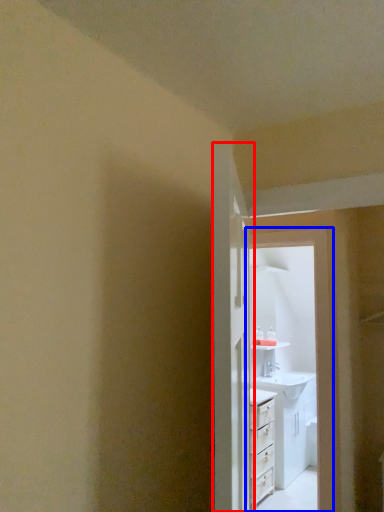
Question: Which of the following is the farthest to the observer, door (highlighted by a red box) or screen door (highlighted by a blue box)?

Choices:
 (A) door
 (B) screen door

Answer: (B)